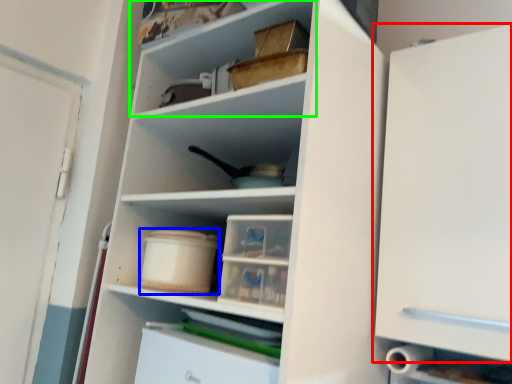
Question: Which is nearer to the cabinetry (highlighted by a red box)? storage box (highlighted by a blue box) or shelf (highlighted by a green box).

Choices:
 (A) storage box
 (B) shelf

Answer: (B)